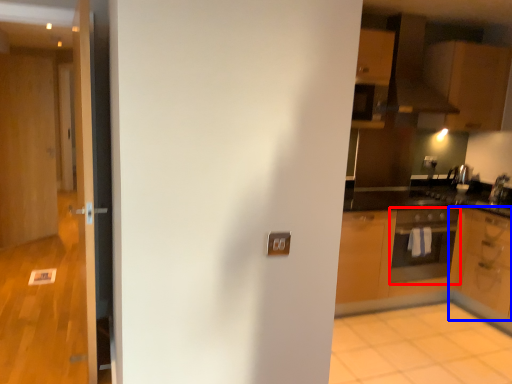
Question: Which object is further to the camera taking this photo, oven (highlighted by a red box) or cabinetry (highlighted by a blue box)?

Choices:
 (A) oven
 (B) cabinetry

Answer: (A)